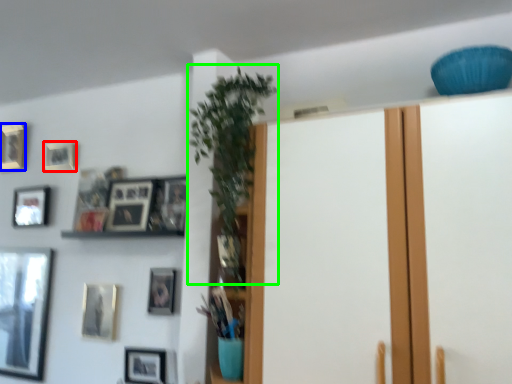
Question: Considering the real-world distances, which object is farthest from picture frame (highlighted by a red box)? picture frame (highlighted by a blue box) or plant (highlighted by a green box)?

Choices:
 (A) picture frame
 (B) plant

Answer: (B)